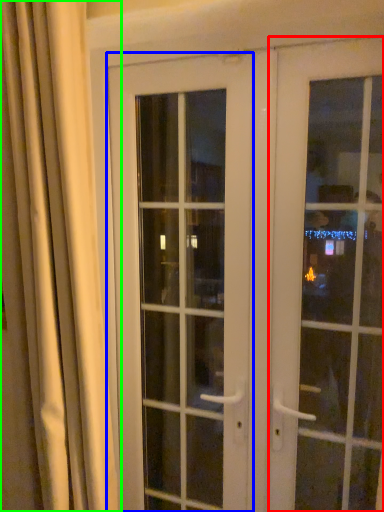
Question: Estimate the real-world distances between objects in this image. Which object is farther from door (highlighted by a red box), door (highlighted by a blue box) or curtain (highlighted by a green box)?

Choices:
 (A) door
 (B) curtain

Answer: (B)